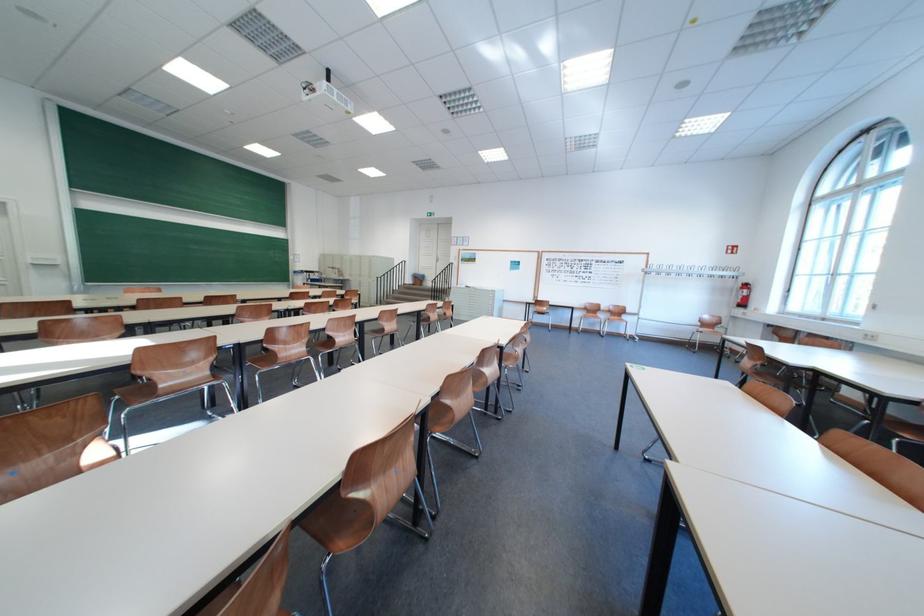
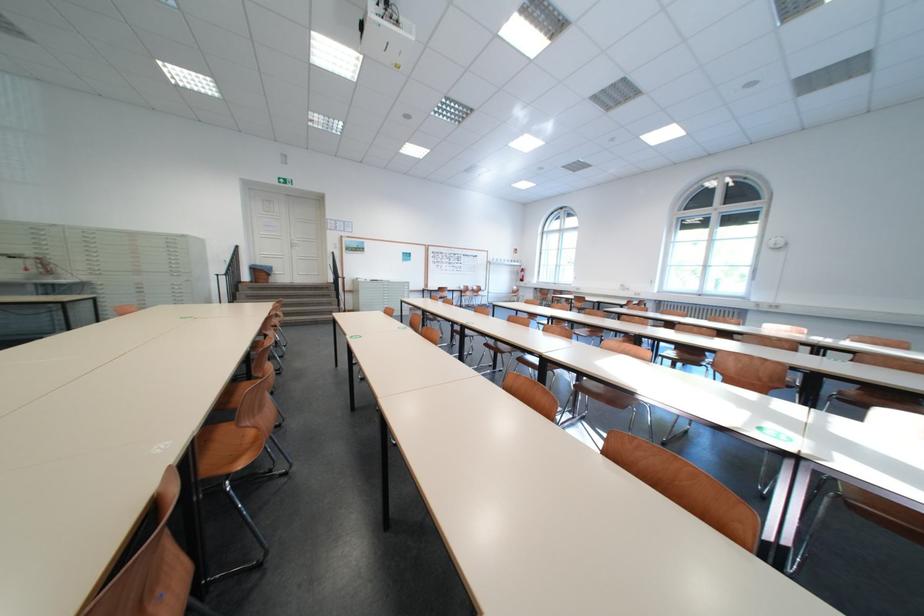
Question: I am providing you with two images of the same scene from different viewpoints. Which of the following objects are not visible in image2?

Choices:
 (A) blue and red box
 (B) brown chair sitting surface
 (C) black metal railing
 (D) grey drawer handle

Answer: (B)